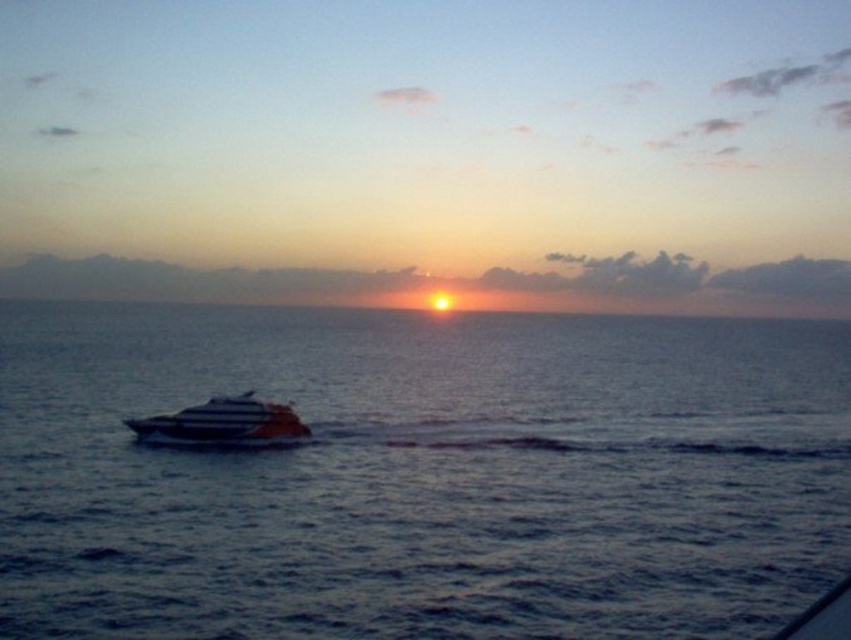
Question: Is blue water at center above white glossy boat at center?

Choices:
 (A) no
 (B) yes

Answer: (B)

Question: Does blue water at center lie behind white glossy boat at center?

Choices:
 (A) yes
 (B) no

Answer: (B)

Question: In this image, where is blue water at center located relative to white glossy boat at center?

Choices:
 (A) right
 (B) left

Answer: (A)

Question: Among these objects, which one is farthest from the camera?

Choices:
 (A) white glossy boat at center
 (B) blue water at center

Answer: (A)

Question: Which point appears farthest from the camera in this image?

Choices:
 (A) (509, 320)
 (B) (212, 436)

Answer: (A)